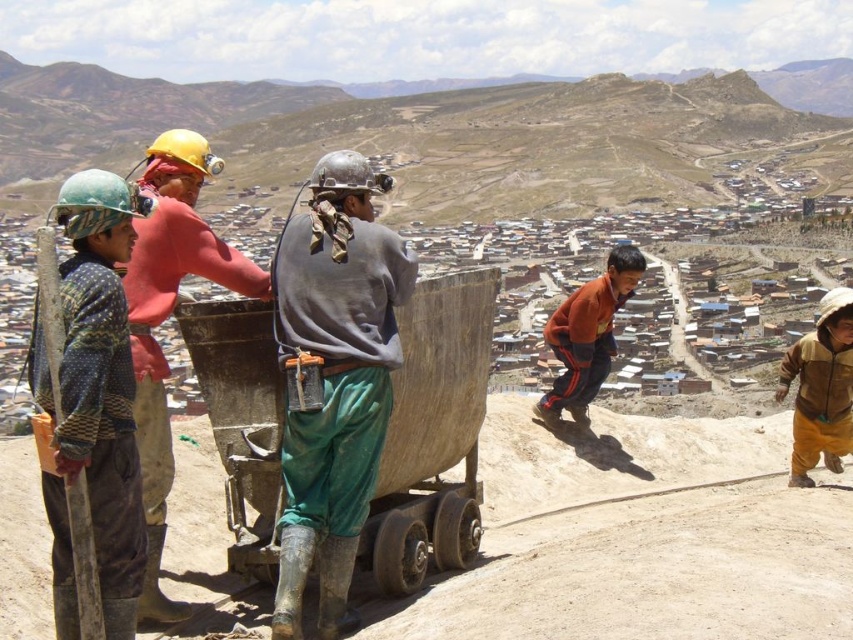
Based on the photo, measure the distance from matte yellow hard hat at upper left to orange fleece jacket at center.

A distance of 41.21 meters exists between matte yellow hard hat at upper left and orange fleece jacket at center.

Is point (194, 240) farther from viewer compared to point (579, 413)?

No, it is in front of (579, 413).

Identify the location of matte yellow hard hat at upper left. (167, 316).

Which is behind, point (68, 371) or point (608, 344)?

Positioned behind is point (608, 344).

The width and height of the screenshot is (853, 640). Identify the location of knitted sweater at left. (93, 404).

Can you confirm if matte yellow hard hat at upper left is thinner than brown fuzzy jacket at right?

Indeed, matte yellow hard hat at upper left has a lesser width compared to brown fuzzy jacket at right.

Which is above, matte yellow hard hat at upper left or brown fuzzy jacket at right?

matte yellow hard hat at upper left

Is point (166, 436) in front of point (849, 314)?

Yes.

Find the location of a particular element. matte yellow hard hat at upper left is located at coordinates (167, 316).